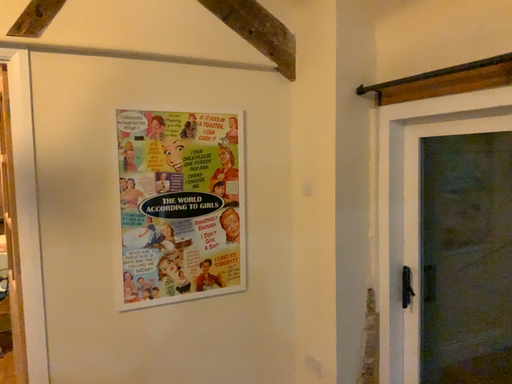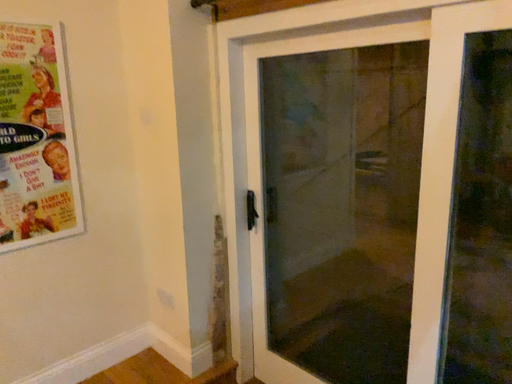
Question: Which way did the camera rotate in the video?

Choices:
 (A) rotated downward
 (B) rotated upward

Answer: (A)